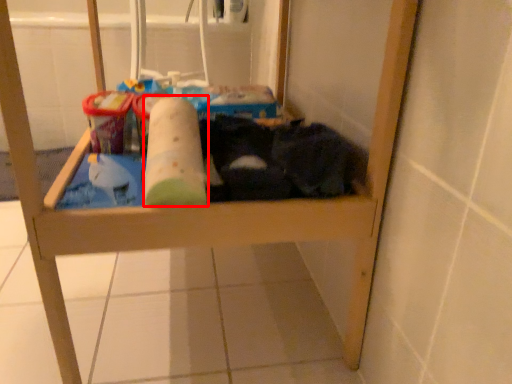
Question: Where is toilet paper (annotated by the red box) located in relation to laundry in the image?

Choices:
 (A) left
 (B) right

Answer: (A)